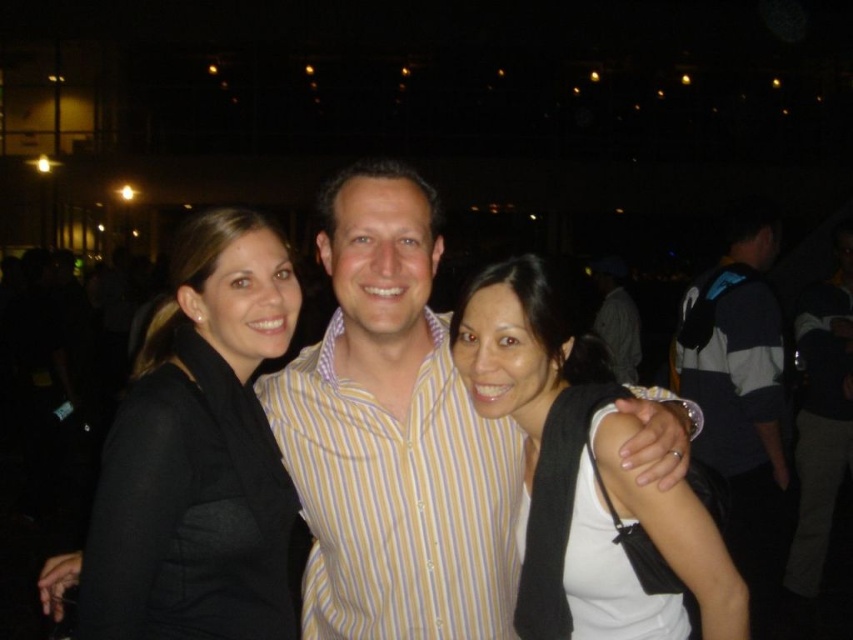
You are a photographer at the event and want to ensure that both the black matte blazer at left and the white matte shirt at center are clearly visible in the photo. Given their sizes, which one might require you to adjust your camera focus more carefully to avoid blurriness?

The black matte blazer at left occupies less space than the white matte shirt at center, so the black matte blazer at left might require more careful focus adjustment due to its smaller size to ensure clarity.